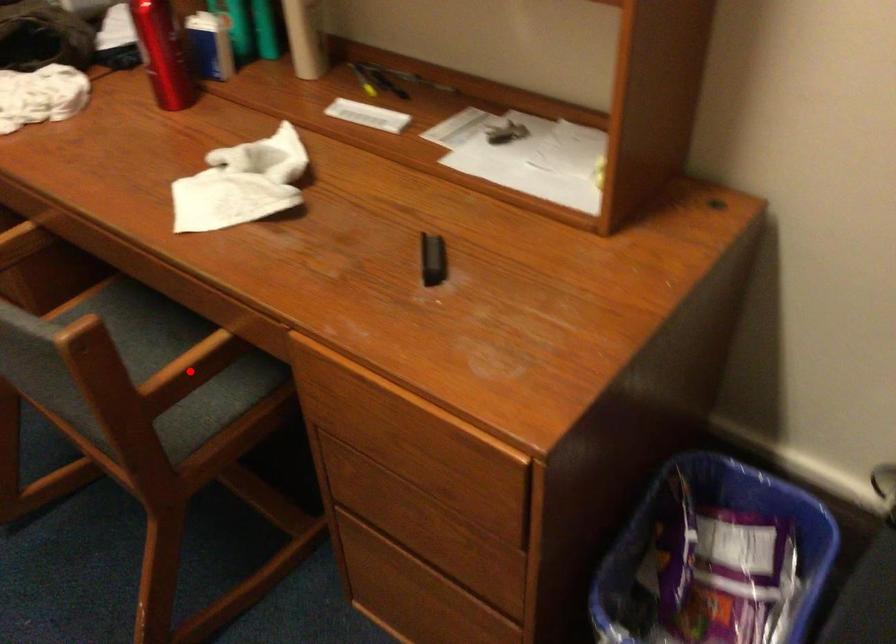
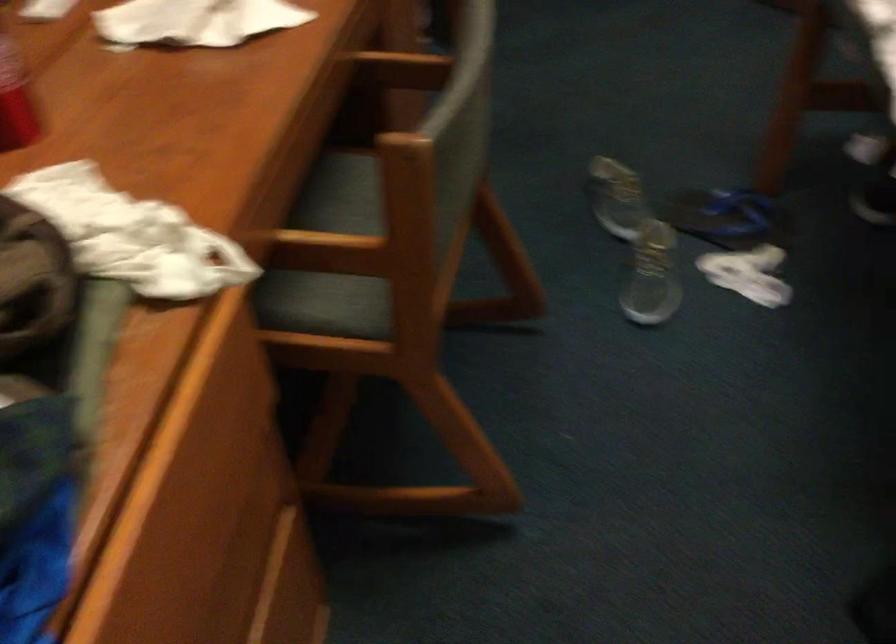
Question: I am providing you with two images of the same scene from different viewpoints. Given a red point in image1, look at the same physical point in image2. Is it:

Choices:
 (A) Closer to the viewpoint
 (B) Farther from the viewpoint

Answer: (B)